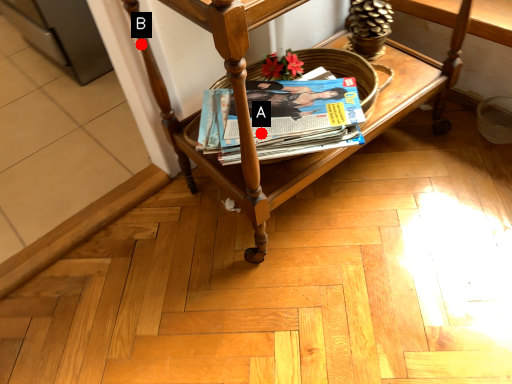
Question: Two points are circled on the image, labeled by A and B beside each circle. Which point is farther from the camera taking this photo?

Choices:
 (A) A is further
 (B) B is further

Answer: (B)